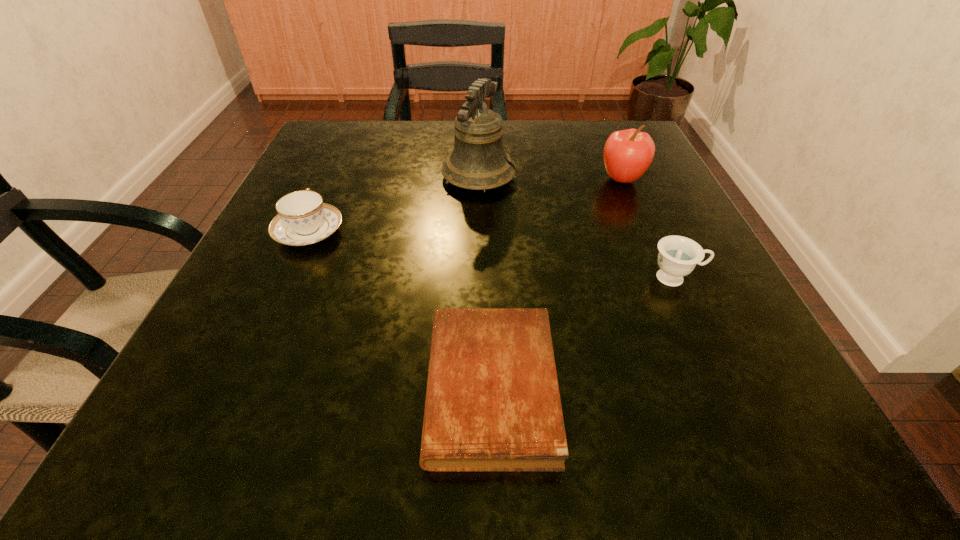
Find the location of `free spot between the fourth shortest object and the bell`. free spot between the fourth shortest object and the bell is located at coordinates tap(550, 178).

Identify the location of free space between the third nearest object and the tallest object. This screenshot has width=960, height=540. (394, 205).

You are a GUI agent. You are given a task and a screenshot of the screen. Output one action in this format:
    pyautogui.click(x=<x>, y=<y>)
    Task: Click on the empty space between the bell and the shortest object
    
    Given the screenshot: What is the action you would take?
    point(485,282)

This screenshot has height=540, width=960. Find the location of `free space between the shortest object and the fourth shortest object`. free space between the shortest object and the fourth shortest object is located at coordinates (557, 284).

The width and height of the screenshot is (960, 540). I want to click on blank region between the nearest object and the farther teacup, so click(400, 310).

At what (x,y) coordinates should I click in order to perform the action: click on free space between the fourth farthest object and the bell. Please return your answer as a coordinate pair (x, y). This screenshot has height=540, width=960. Looking at the image, I should click on (577, 227).

The image size is (960, 540). I want to click on free space between the leftmost object and the fourth shortest object, so click(x=466, y=206).

Where is `free area in between the left teacup and the apple`? free area in between the left teacup and the apple is located at coordinates (466, 206).

Identify the location of vacant space in between the second nearest object and the left teacup. Image resolution: width=960 pixels, height=540 pixels. (492, 255).

You are a GUI agent. You are given a task and a screenshot of the screen. Output one action in this format:
    pyautogui.click(x=<x>, y=<y>)
    Task: Click on the vacant space that's between the nearest object and the leftmost object
    Image resolution: width=960 pixels, height=540 pixels.
    Given the screenshot: What is the action you would take?
    pyautogui.click(x=400, y=310)